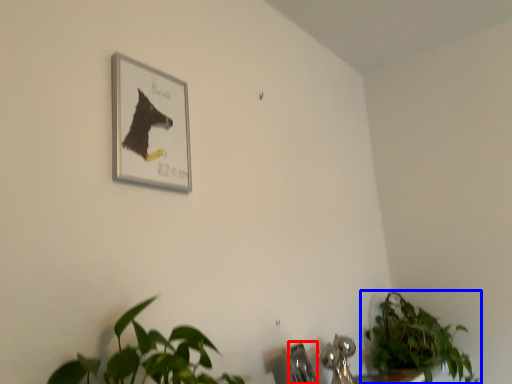
Question: Which object is closer to the camera taking this photo, faucet (highlighted by a red box) or houseplant (highlighted by a blue box)?

Choices:
 (A) faucet
 (B) houseplant

Answer: (A)